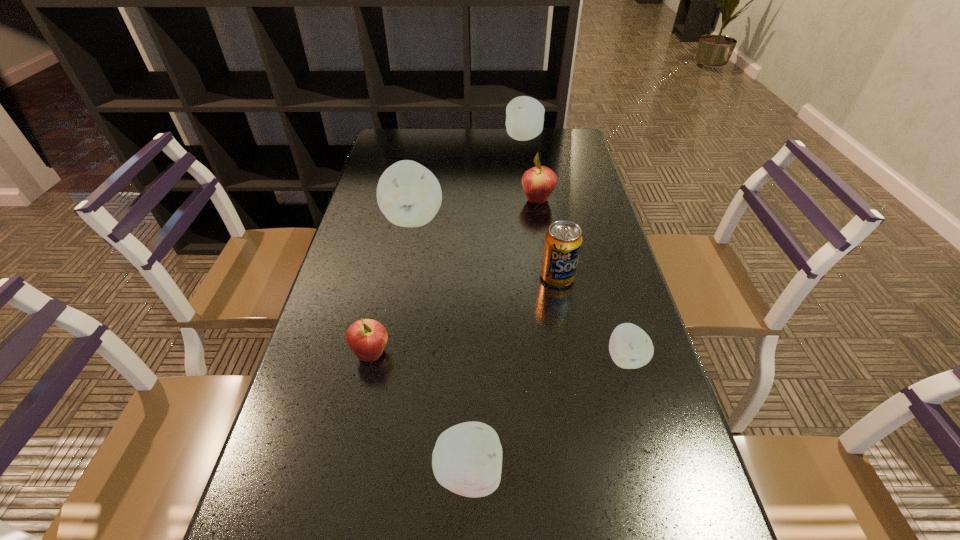
Locate an element on the screen. The height and width of the screenshot is (540, 960). the biggest white apple is located at coordinates (409, 195).

At what (x,y) coordinates should I click in order to perform the action: click on the second farthest white apple. Please return your answer as a coordinate pair (x, y). Looking at the image, I should click on coord(409,195).

This screenshot has width=960, height=540. Identify the location of the third white apple from left to right. (524, 115).

You are a GUI agent. You are given a task and a screenshot of the screen. Output one action in this format:
    pyautogui.click(x=<x>, y=<y>)
    Task: Click on the second biggest white apple
    
    Given the screenshot: What is the action you would take?
    pyautogui.click(x=524, y=115)

This screenshot has width=960, height=540. What are the coordinates of `the farther red apple` in the screenshot? It's located at point(538,183).

Find the location of `the right red apple`. the right red apple is located at coordinates (538, 183).

Identify the location of soda can. Image resolution: width=960 pixels, height=540 pixels. click(563, 241).

Find the location of a particular element. Image resolution: width=960 pixels, height=540 pixels. the smaller red apple is located at coordinates (366, 338).

You are a GUI agent. You are given a task and a screenshot of the screen. Output one action in this format:
    pyautogui.click(x=<x>, y=<y>)
    Task: Click on the nearer red apple
    This screenshot has width=960, height=540.
    Given the screenshot: What is the action you would take?
    pyautogui.click(x=366, y=338)

Locate an element on the screen. The width and height of the screenshot is (960, 540). the nearest white apple is located at coordinates (467, 458).